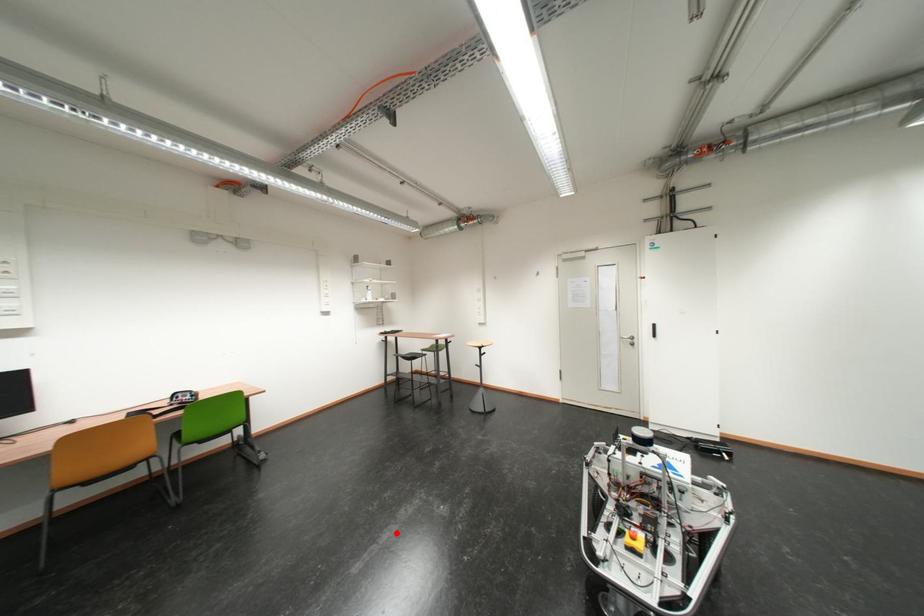
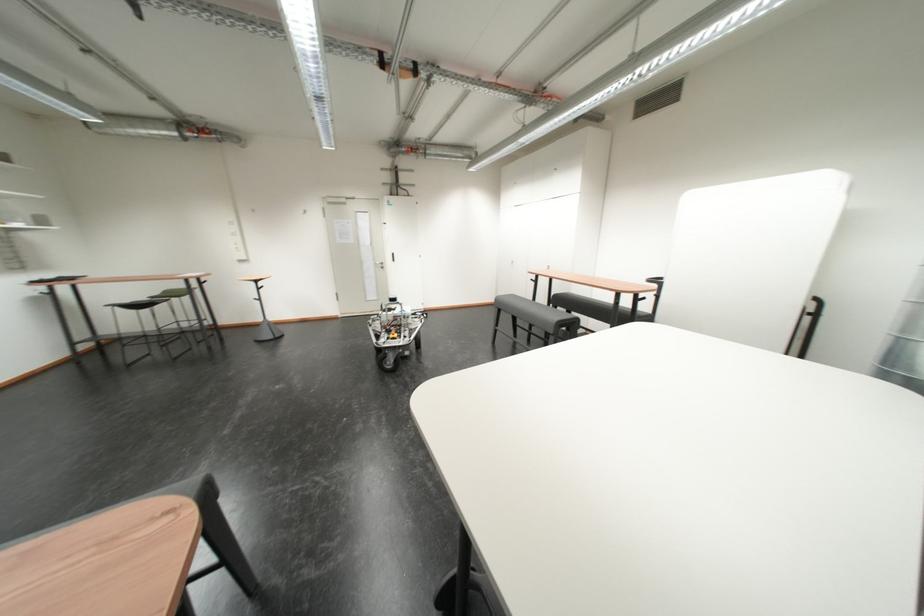
Where in the second image is the point corresponding to the highlighted location from the first image?

(246, 416)